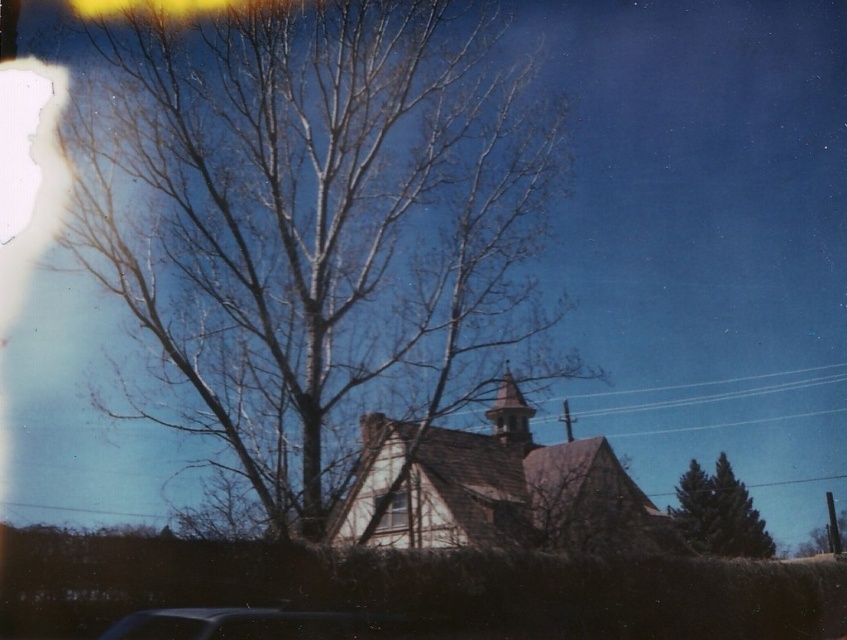
You are a delivery person who needs to park your shiny black car at lower center near the transparent glass window at center. Given that the parking space between them is 22.03 feet, is this distance sufficient for a standard delivery van that requires 20 feet of space?

The distance between the shiny black car at lower center and the transparent glass window at center is 22.03 feet, which is more than enough for a standard delivery van requiring 20 feet of space.

You are a photographer wanting to capture the green textured pine tree at lower right and the transparent glass window at center in a single frame. Which object will appear larger in the photo?

The green textured pine tree at lower right will appear larger in the photo because it is bigger than the transparent glass window at center.

You are standing at the entrance of the rustic building and want to take a photo of the green textured pine tree at lower right. If your camera has a field of view that covers up to 0.8 on the x and y axes, will the tree be fully visible in your photo?

The green textured pine tree at lower right is located at point (x=696, y=508). Since the camera covers up to 0.8 on both axes, the tree is slightly beyond the upper y boundary of the camera field of view and will not be fully visible.